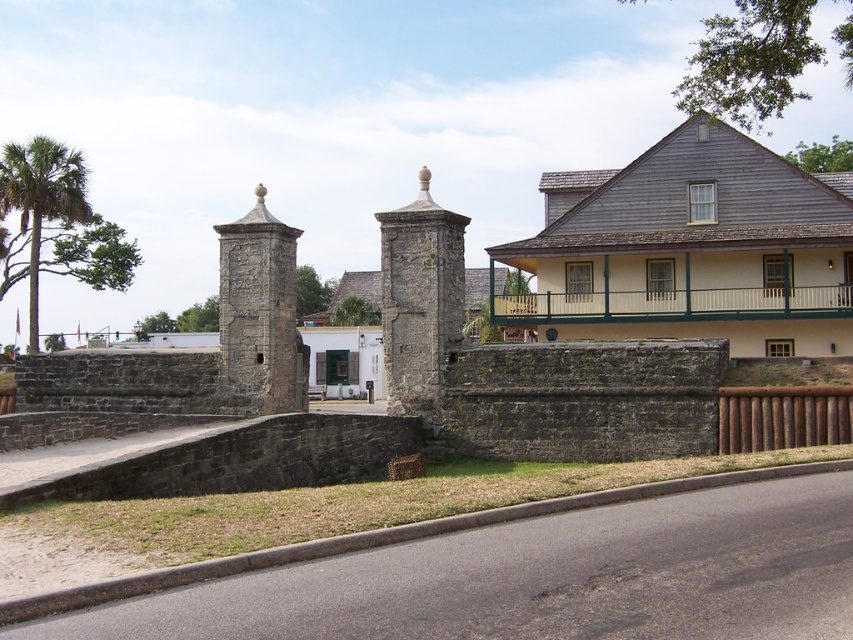
Who is higher up, stone textured gate at center or rustic stone tower at left?

stone textured gate at center

Locate an element on the screen. stone textured gate at center is located at coordinates (421, 301).

I want to click on stone textured gate at center, so click(x=421, y=301).